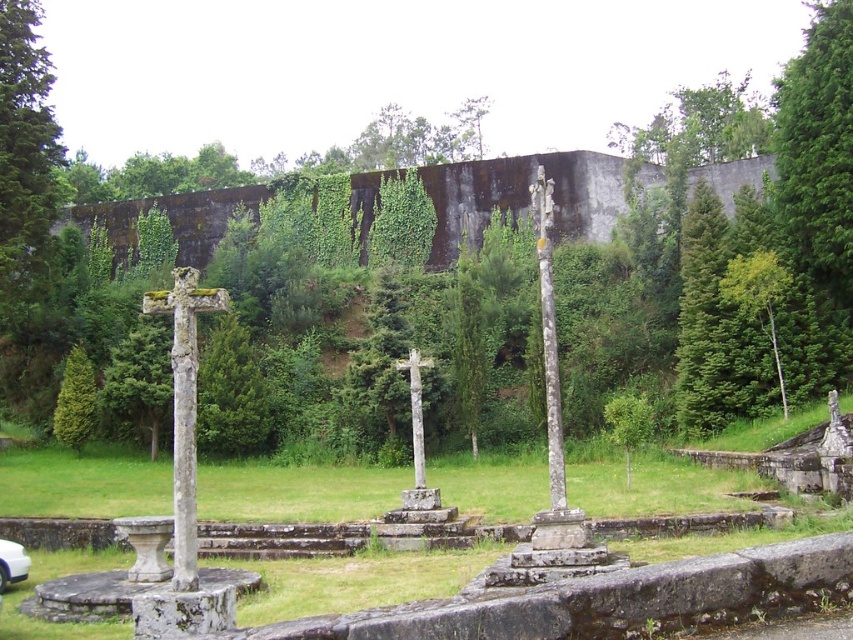
Is green textured stone cross at lower left positioned at the back of white stone cross at center?

That is True.

Between green textured stone cross at lower left and white stone cross at center, which one is positioned higher?

green textured stone cross at lower left

Is point (65, 365) closer to viewer compared to point (418, 388)?

That is False.

Identify the location of green textured stone cross at lower left. (74, 400).

Is white stone cross at center positioned in front of white glossy car at lower left?

No, white stone cross at center is behind white glossy car at lower left.

Measure the distance between point (408,358) and camera.

Point (408,358) and camera are 28.94 meters apart from each other.

Measure the distance between white stone cross at center and camera.

They are 27.58 meters apart.

This screenshot has width=853, height=640. I want to click on white stone cross at center, so click(x=416, y=412).

Looking at this image, does stone cross at left appear on the right side of white glossy car at lower left?

Yes, stone cross at left is to the right of white glossy car at lower left.

Can you confirm if stone cross at left is shorter than white glossy car at lower left?

In fact, stone cross at left may be taller than white glossy car at lower left.

Locate an element on the screen. The width and height of the screenshot is (853, 640). stone cross at left is located at coordinates (184, 410).